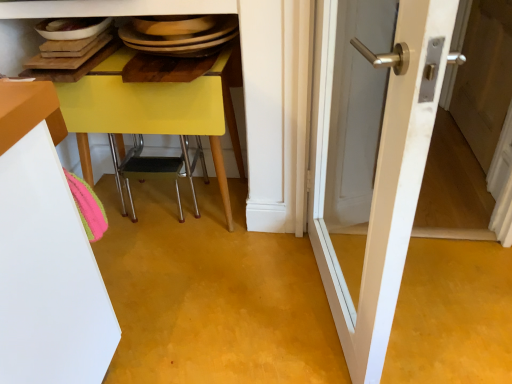
Locate an element on the screen. The width and height of the screenshot is (512, 384). empty space that is in between yellow plastic chair at lower center and white glossy door at center is located at coordinates (232, 276).